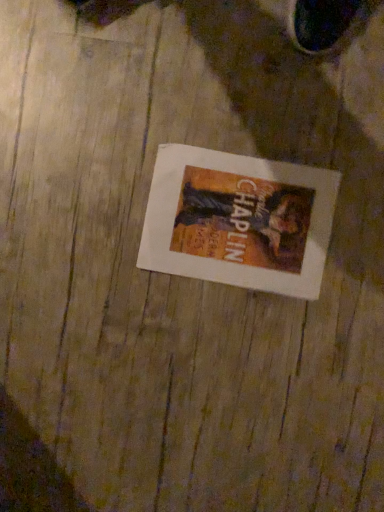
At what (x,y) coordinates should I click in order to perform the action: click on free space above white paper book at center (from a real-world perspective). Please return your answer as a coordinate pair (x, y). This screenshot has height=512, width=384. Looking at the image, I should click on (236, 217).